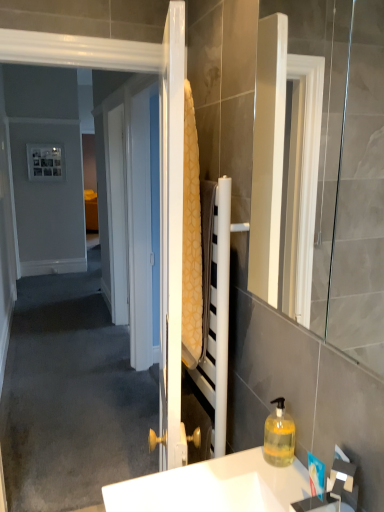
The height and width of the screenshot is (512, 384). What do you see at coordinates (191, 240) in the screenshot?
I see `yellow textured towel at center` at bounding box center [191, 240].

Find the location of `white glossy mirror at right`. white glossy mirror at right is located at coordinates coord(347,170).

How distant is translucent yellow liquid at lower right from yellow textured towel at center?

A distance of 18.41 inches exists between translucent yellow liquid at lower right and yellow textured towel at center.

Is translucent yellow liquid at lower right in contact with yellow textured towel at center?

No, translucent yellow liquid at lower right is not beside yellow textured towel at center.

Is translucent yellow liquid at lower right positioned with its back to yellow textured towel at center?

No, translucent yellow liquid at lower right is not facing away from yellow textured towel at center.

Which object is wider, translucent yellow liquid at lower right or yellow textured towel at center?

With larger width is translucent yellow liquid at lower right.

Is white glossy sink at lower center taller than translucent yellow liquid at lower right?

In fact, white glossy sink at lower center may be shorter than translucent yellow liquid at lower right.

From the image's perspective, is white glossy sink at lower center located above translucent yellow liquid at lower right?

No.

Is white glossy sink at lower center in front of or behind translucent yellow liquid at lower right in the image?

white glossy sink at lower center is in front of translucent yellow liquid at lower right.

Looking at this image, is yellow textured towel at center taller than white glossy sink at lower center?

Yes, yellow textured towel at center is taller than white glossy sink at lower center.

Between yellow textured towel at center and white glossy sink at lower center, which one appears on the left side from the viewer's perspective?

yellow textured towel at center.

From the image's perspective, who appears lower, yellow textured towel at center or white glossy sink at lower center?

white glossy sink at lower center appears lower in the image.

How different are the orientations of yellow textured towel at center and white glossy sink at lower center in degrees?

17.5 degrees.

Considering the sizes of objects white glossy mirror at right and yellow textured towel at center in the image provided, who is bigger, white glossy mirror at right or yellow textured towel at center?

white glossy mirror at right.

Consider the image. Between white glossy mirror at right and yellow textured towel at center, which one appears on the right side from the viewer's perspective?

Positioned to the right is white glossy mirror at right.

From a real-world perspective, between white glossy mirror at right and yellow textured towel at center, who is vertically higher?

From a 3D spatial view, white glossy mirror at right is above.

Can you tell me how much white glossy mirror at right and yellow textured towel at center differ in facing direction?

18 degrees.

Which of these two, white glossy mirror at right or white glossy sink at lower center, is smaller?

white glossy sink at lower center.

Would you say white glossy sink at lower center is part of white glossy mirror at right's contents?

No.

From the picture: Which is more to the right, white glossy mirror at right or white glossy sink at lower center?

From the viewer's perspective, white glossy mirror at right appears more on the right side.

Is white glossy mirror at right taller or shorter than white glossy sink at lower center?

white glossy mirror at right is taller than white glossy sink at lower center.

Image resolution: width=384 pixels, height=512 pixels. Find the location of `sink below the white glossy mirror at right (from the image's perspective)`. sink below the white glossy mirror at right (from the image's perspective) is located at coordinates (219, 488).

Which of these two, white glossy sink at lower center or white glossy mirror at right, stands shorter?

With less height is white glossy sink at lower center.

Looking at the image, does white glossy sink at lower center seem bigger or smaller compared to white glossy mirror at right?

Clearly, white glossy sink at lower center is smaller in size than white glossy mirror at right.

Is white glossy sink at lower center facing away from white glossy mirror at right?

No, white glossy sink at lower center is not facing the opposite direction of white glossy mirror at right.

The width and height of the screenshot is (384, 512). In order to click on mirror that is on the right side of yellow textured towel at center in this screenshot , I will do `click(347, 170)`.

Is yellow textured towel at center smaller than white glossy mirror at right?

Correct, yellow textured towel at center occupies less space than white glossy mirror at right.

Which point is more forward, (195, 185) or (383, 168)?

Point (195, 185)

From a real-world perspective, is yellow textured towel at center positioned over white glossy mirror at right based on gravity?

Incorrect, from a real-world perspective, yellow textured towel at center is lower than white glossy mirror at right.

The image size is (384, 512). I want to click on bottle below the yellow textured towel at center (from a real-world perspective), so click(279, 436).

I want to click on bottle behind the white glossy sink at lower center, so click(x=279, y=436).

Looking at the image, which one is located closer to white glossy sink at lower center, yellow textured towel at center or translucent yellow liquid at lower right?

translucent yellow liquid at lower right.

Based on their spatial positions, is white glossy sink at lower center or yellow textured towel at center closer to translucent yellow liquid at lower right?

white glossy sink at lower center lies closer to translucent yellow liquid at lower right than the other object.

When comparing their distances from yellow textured towel at center, does white glossy mirror at right or translucent yellow liquid at lower right seem closer?

Among the two, translucent yellow liquid at lower right is located nearer to yellow textured towel at center.

Estimate the real-world distances between objects in this image. Which object is closer to white glossy mirror at right, white glossy sink at lower center or translucent yellow liquid at lower right?

Among the two, translucent yellow liquid at lower right is located nearer to white glossy mirror at right.

Consider the image. Considering their positions, is translucent yellow liquid at lower right positioned further to white glossy mirror at right than white glossy sink at lower center?

white glossy sink at lower center lies further to white glossy mirror at right than the other object.

When comparing their distances from white glossy sink at lower center, does white glossy mirror at right or translucent yellow liquid at lower right seem closer?

Based on the image, translucent yellow liquid at lower right appears to be nearer to white glossy sink at lower center.

Considering their positions, is translucent yellow liquid at lower right positioned closer to white glossy sink at lower center than white glossy mirror at right?

translucent yellow liquid at lower right is closer to white glossy sink at lower center.

Which object lies nearer to the anchor point white glossy sink at lower center, yellow textured towel at center or white glossy mirror at right?

yellow textured towel at center is closer to white glossy sink at lower center.

The height and width of the screenshot is (512, 384). I want to click on bath towel between white glossy mirror at right and white glossy sink at lower center from top to bottom, so click(x=191, y=240).

Where is `bottle between yellow textured towel at center and white glossy sink at lower center in the up-down direction`? The image size is (384, 512). bottle between yellow textured towel at center and white glossy sink at lower center in the up-down direction is located at coordinates (279, 436).

The height and width of the screenshot is (512, 384). What are the coordinates of `bath towel between white glossy mirror at right and translucent yellow liquid at lower right in the front-back direction` in the screenshot? It's located at (191, 240).

Identify the location of bottle between white glossy mirror at right and white glossy sink at lower center in the vertical direction. Image resolution: width=384 pixels, height=512 pixels. (279, 436).